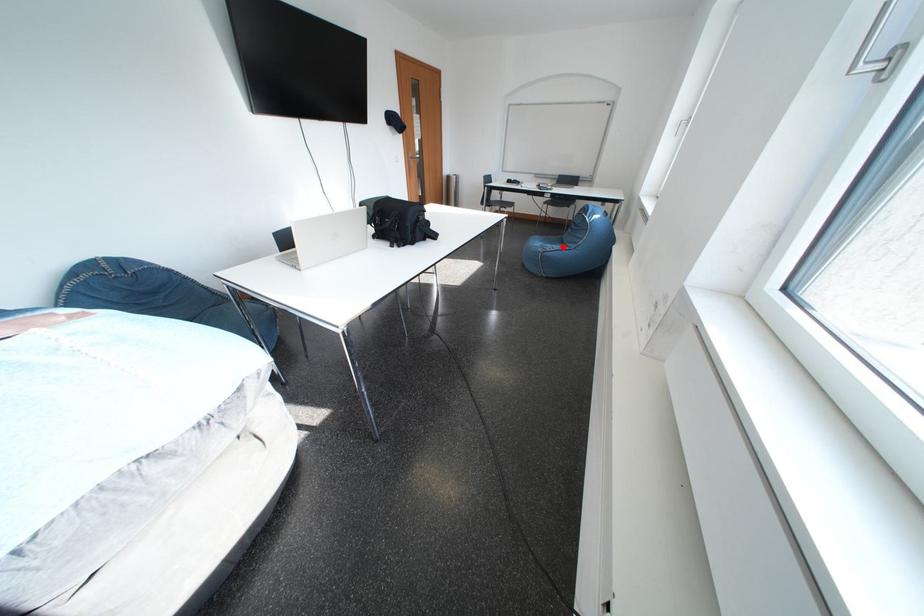
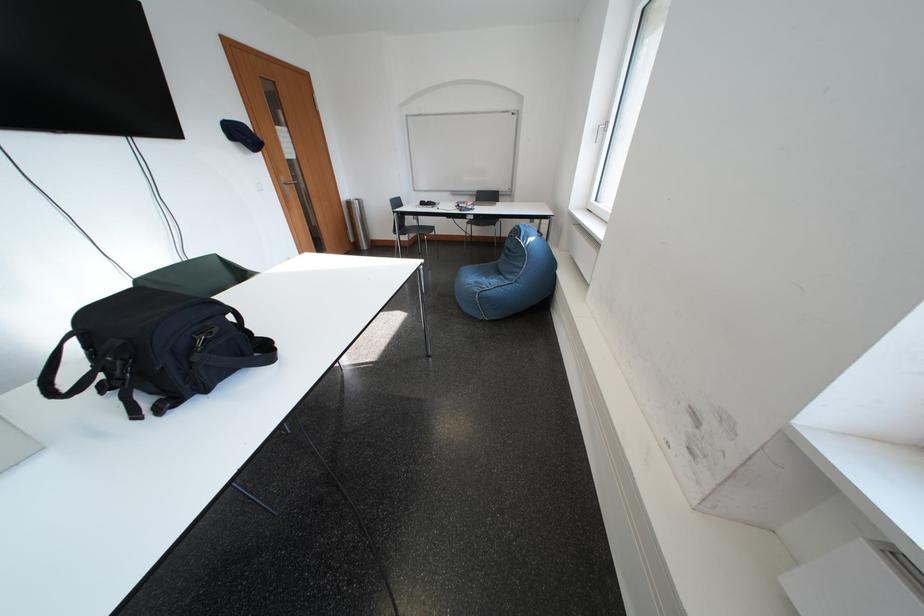
Question: A red point is marked in image1. In image2, is the corresponding 3D point closer to the camera or farther? Reply with the corresponding letter.

Choices:
 (A) The corresponding 3D point is closer.
 (B) The corresponding 3D point is farther.

Answer: (B)